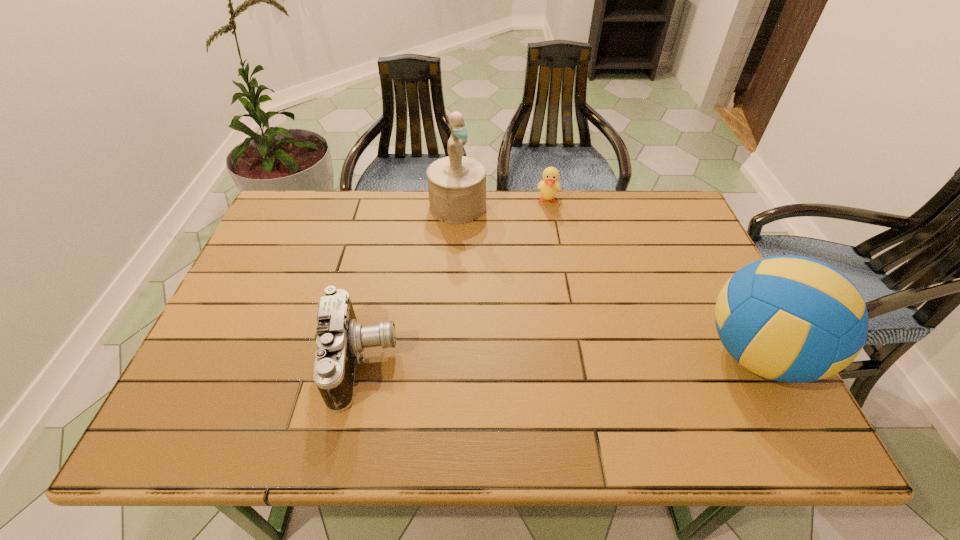
At what (x,y) coordinates should I click in order to perform the action: click on blank area in the image that satisfies the following two spatial constraints: 1. on the back side of the tallest object; 2. on the left side of the third object from left to right. Please return your answer as a coordinate pair (x, y). The width and height of the screenshot is (960, 540). Looking at the image, I should click on (458, 200).

Where is `free space that satisfies the following two spatial constraints: 1. on the front side of the third shortest object; 2. on the right side of the third object from left to right`? The height and width of the screenshot is (540, 960). free space that satisfies the following two spatial constraints: 1. on the front side of the third shortest object; 2. on the right side of the third object from left to right is located at coordinates (576, 354).